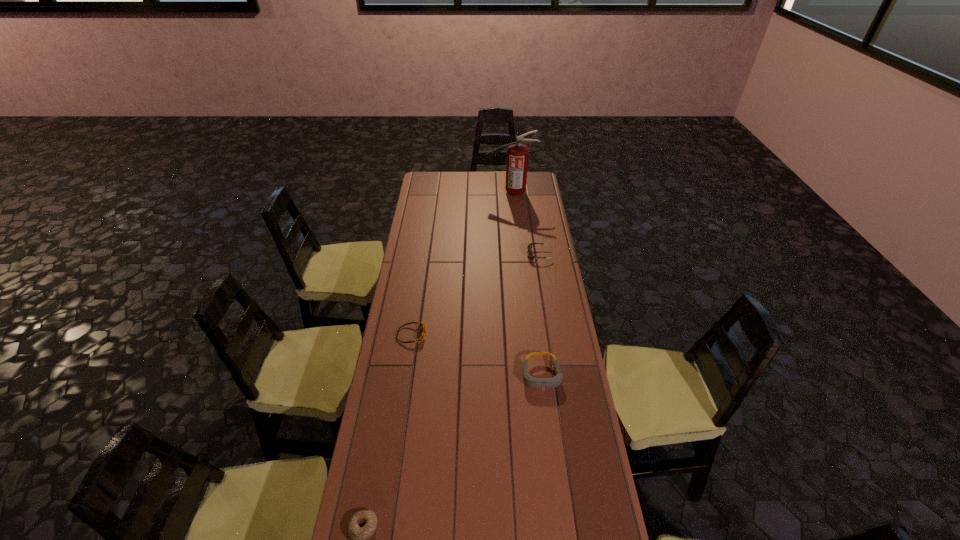
The height and width of the screenshot is (540, 960). Identify the location of free space at the left edge of the desktop. (390, 372).

This screenshot has height=540, width=960. In order to click on vacant space at the right edge in this screenshot , I will do `click(550, 259)`.

Locate an element on the screen. Image resolution: width=960 pixels, height=540 pixels. vacant space in between the fourth farthest object and the fourth nearest object is located at coordinates (540, 315).

Locate an element on the screen. The height and width of the screenshot is (540, 960). free space between the second farthest object and the nearest goggles is located at coordinates (540, 315).

Find the location of `unoccupied area between the third farthest object and the nearest goggles`. unoccupied area between the third farthest object and the nearest goggles is located at coordinates (476, 355).

Image resolution: width=960 pixels, height=540 pixels. In order to click on unoccupied position between the leftmost goggles and the second farthest object in this screenshot , I will do `click(475, 295)`.

You are a GUI agent. You are given a task and a screenshot of the screen. Output one action in this format:
    pyautogui.click(x=<x>, y=<y>)
    Task: Click on the vacant space that is in between the second tallest object and the farthest goggles
    This screenshot has width=960, height=540.
    Given the screenshot: What is the action you would take?
    pyautogui.click(x=540, y=315)

Where is `vacant area between the tallest object and the shortest goggles`? vacant area between the tallest object and the shortest goggles is located at coordinates (461, 264).

Identify which object is the nearest to the leftmost goggles. Please provide its 2D coordinates. Your answer should be formatted as a tuple, i.e. [(x, y)], where the tuple contains the x and y coordinates of a point satisfying the conditions above.

[(530, 381)]

Select which object appears as the closest to the shortest goggles. Please provide its 2D coordinates. Your answer should be formatted as a tuple, i.e. [(x, y)], where the tuple contains the x and y coordinates of a point satisfying the conditions above.

[(530, 381)]